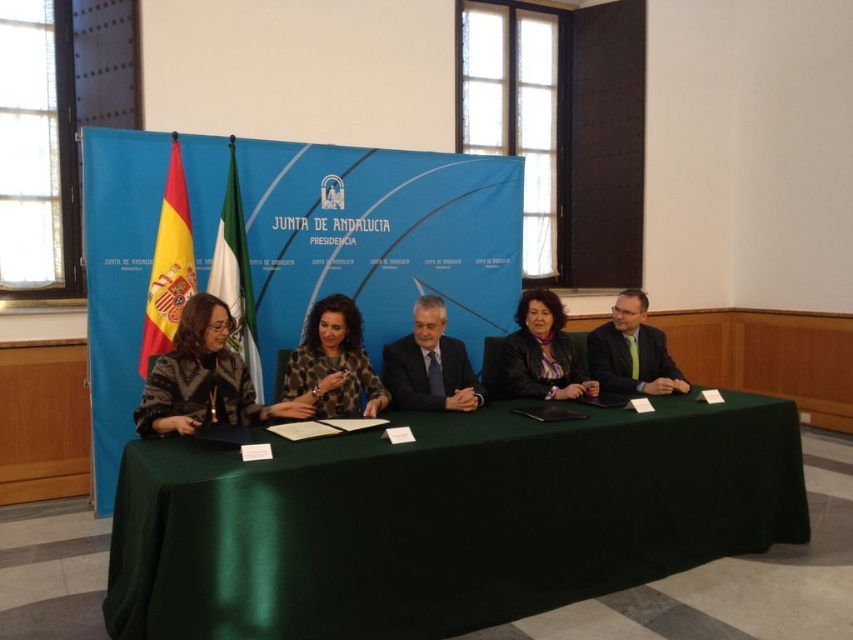
You are standing at the point labeled point (204, 637) and want to take a photo of the scene. The camera you have can focus on subjects within 2 meters. Will the camera be able to capture the entire scene clearly?

The distance between point (204, 637) and the camera is 2.16 meters, which is beyond the camera focus range of 2 meters. Therefore, the camera will not be able to capture the entire scene clearly.

You are organizing a small meeting and need to place a 1.5 meter long laptop on the green satin table at center. Can the laptop fit on the table if the leather jacket at center is currently occupying part of it?

The green satin table at center is bigger than the leather jacket at center, so the laptop should fit as long as the jacket isn